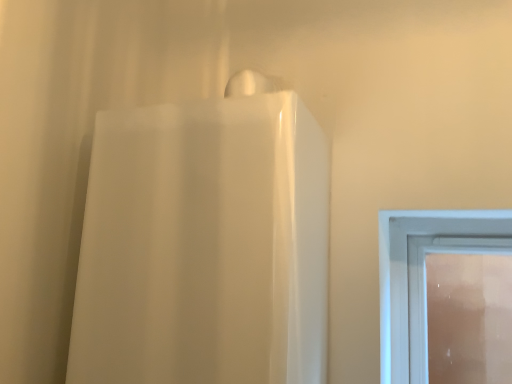
I want to click on white glossy curtain at upper center, so click(x=204, y=246).

What do you see at coordinates (204, 246) in the screenshot?
I see `white glossy curtain at upper center` at bounding box center [204, 246].

Locate an element on the screen. The height and width of the screenshot is (384, 512). white glossy curtain at upper center is located at coordinates (204, 246).